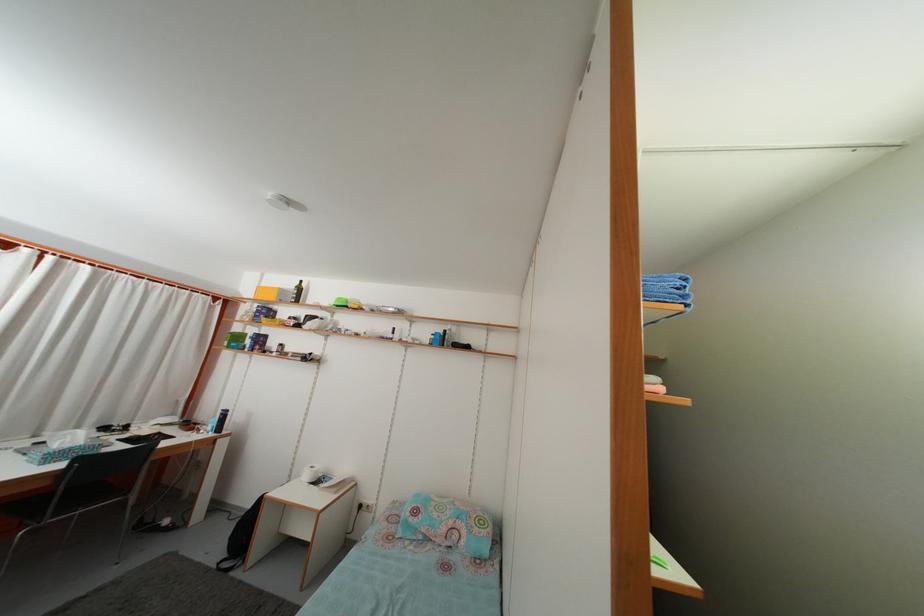
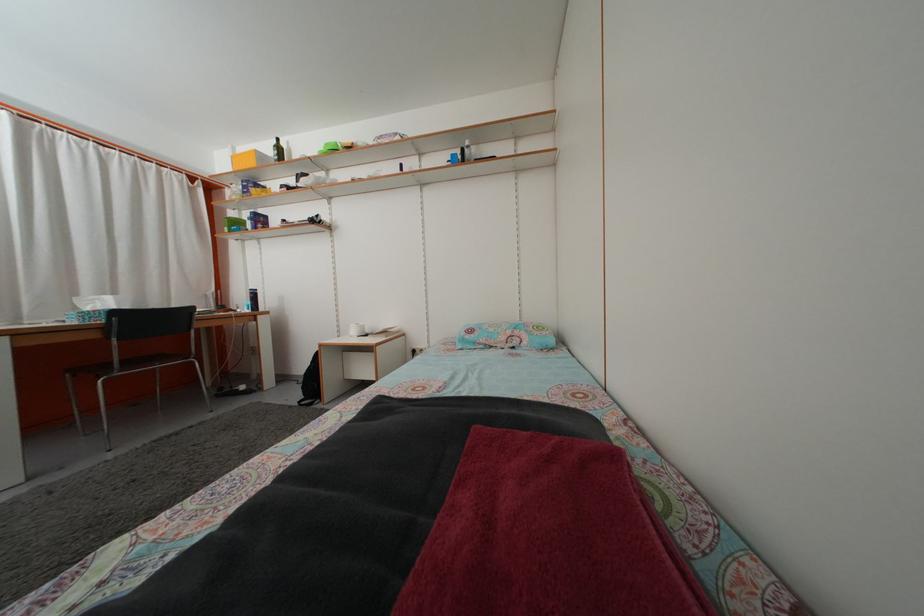
Locate, in the second image, the point that corresponds to (x=242, y=334) in the first image.

(237, 223)